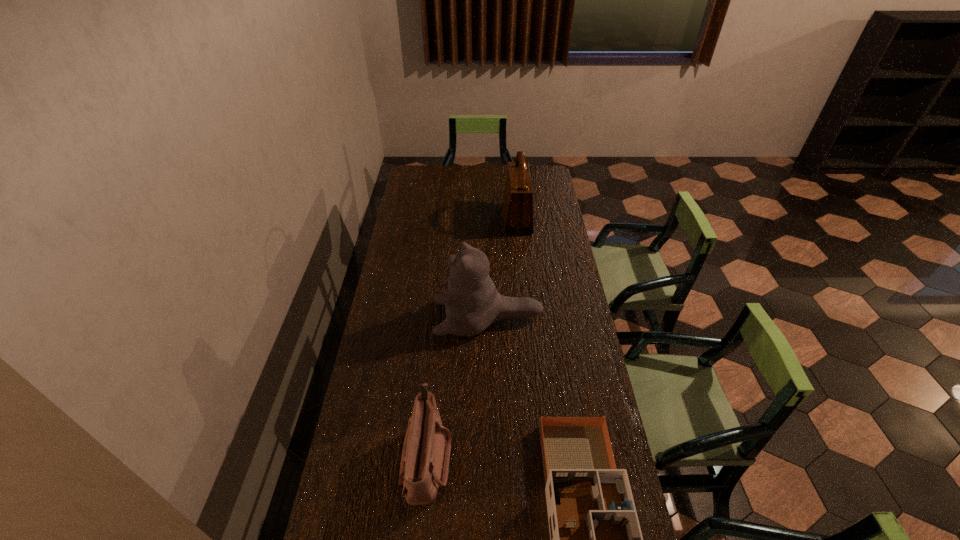
Find the location of `free space that is in between the farther shoulder bag and the second farthest object`. free space that is in between the farther shoulder bag and the second farthest object is located at coordinates (502, 268).

Image resolution: width=960 pixels, height=540 pixels. What are the coordinates of `vacant region between the second farthest object and the taller shoulder bag` in the screenshot? It's located at (502, 268).

Select which object is the closest to the shorter shoulder bag. Please provide its 2D coordinates. Your answer should be formatted as a tuple, i.e. [(x, y)], where the tuple contains the x and y coordinates of a point satisfying the conditions above.

[(595, 537)]

I want to click on the third closest object relative to the cat, so pyautogui.click(x=517, y=212).